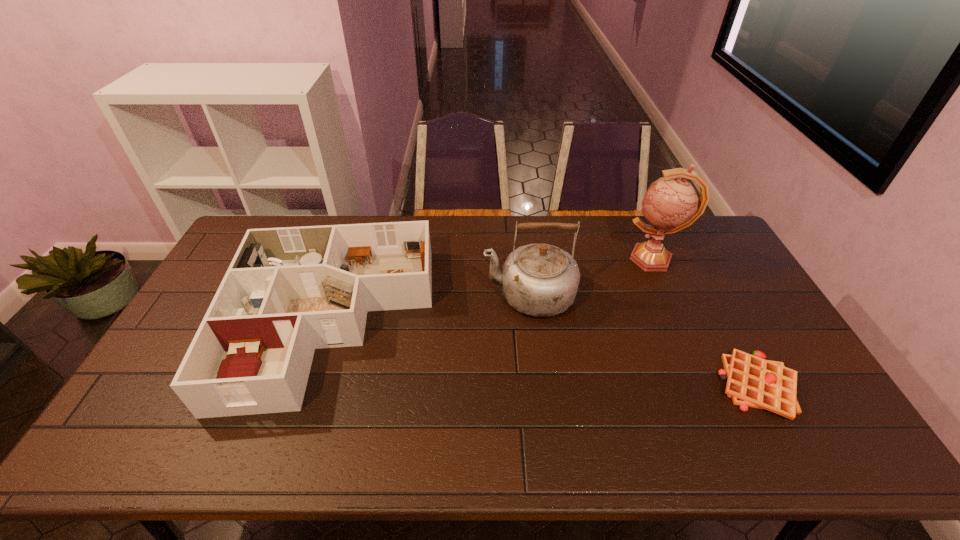
Locate an element on the screen. This screenshot has width=960, height=540. the tallest object is located at coordinates tap(670, 204).

Find the location of a particular element. The width and height of the screenshot is (960, 540). the second tallest object is located at coordinates (540, 280).

Locate an element on the screen. The width and height of the screenshot is (960, 540). the third object from right to left is located at coordinates (540, 280).

At what (x,y) coordinates should I click in order to perform the action: click on dollhouse. Please return your answer as a coordinate pair (x, y). This screenshot has width=960, height=540. Looking at the image, I should click on (288, 291).

This screenshot has height=540, width=960. I want to click on the second shortest object, so click(288, 291).

At what (x,y) coordinates should I click in order to perform the action: click on waffle. Please return your answer as a coordinate pair (x, y). Looking at the image, I should click on (752, 381).

This screenshot has height=540, width=960. I want to click on blank space located 0.130m on the front-facing side of the tallest object, so click(586, 259).

Find the location of a particular element. free region located on the front-facing side of the tallest object is located at coordinates (548, 259).

This screenshot has height=540, width=960. In order to click on vacant space located 0.240m on the front-facing side of the tallest object in this screenshot , I will do `click(554, 259)`.

Where is `free point located at the spout of the kettle`? Image resolution: width=960 pixels, height=540 pixels. free point located at the spout of the kettle is located at coordinates (361, 295).